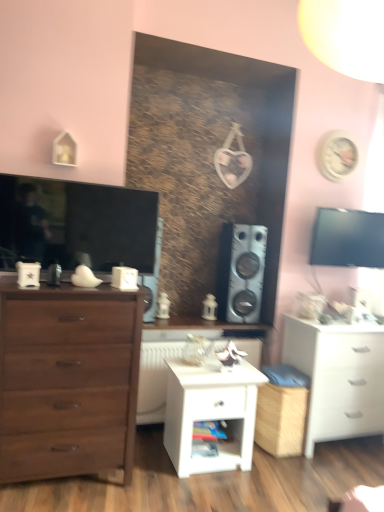
Where is `free spot to the right of matte brown chest of drawers at left, which ranks as the 2th chest of drawers in back-to-front order`? free spot to the right of matte brown chest of drawers at left, which ranks as the 2th chest of drawers in back-to-front order is located at coordinates (152, 480).